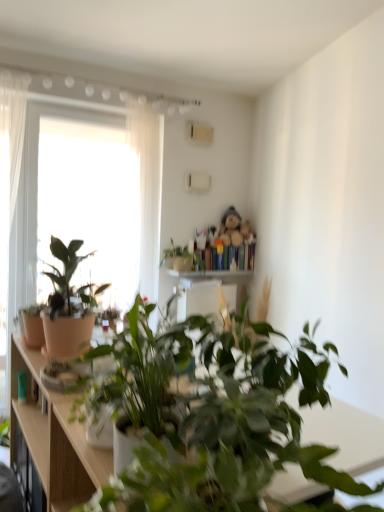
Question: Can you confirm if white sheer curtain at upper left is bigger than wooden at center?

Choices:
 (A) no
 (B) yes

Answer: (B)

Question: Is wooden at center at the back of white sheer curtain at upper left?

Choices:
 (A) no
 (B) yes

Answer: (A)

Question: From the image's perspective, does white sheer curtain at upper left appear lower than wooden at center?

Choices:
 (A) yes
 (B) no

Answer: (B)

Question: Is white sheer curtain at upper left not near wooden at center?

Choices:
 (A) no
 (B) yes

Answer: (A)

Question: Considering the relative sizes of white sheer curtain at upper left and wooden at center in the image provided, is white sheer curtain at upper left smaller than wooden at center?

Choices:
 (A) no
 (B) yes

Answer: (A)

Question: From a real-world perspective, is matte brown cabinet at left physically located above or below matte terracotta pot at left, arranged as the second houseplant when viewed from the back?

Choices:
 (A) above
 (B) below

Answer: (B)

Question: Is matte brown cabinet at left in front of or behind matte terracotta pot at left, arranged as the third houseplant when viewed from the front, in the image?

Choices:
 (A) behind
 (B) front

Answer: (A)

Question: From the image's perspective, is matte brown cabinet at left above or below matte terracotta pot at left, arranged as the second houseplant when viewed from the back?

Choices:
 (A) below
 (B) above

Answer: (A)

Question: Would you say matte brown cabinet at left is to the left or to the right of matte terracotta pot at left, arranged as the third houseplant when viewed from the front, in the picture?

Choices:
 (A) left
 (B) right

Answer: (A)

Question: Is matte terracotta pot at left, arranged as the second houseplant when viewed from the back, in front of or behind matte white pot at center, the first houseplant in the front-to-back sequence, in the image?

Choices:
 (A) behind
 (B) front

Answer: (A)

Question: Based on their sizes in the image, would you say matte terracotta pot at left, arranged as the second houseplant when viewed from the back, is bigger or smaller than matte white pot at center, which is the fourth houseplant in back-to-front order?

Choices:
 (A) small
 (B) big

Answer: (A)

Question: From a real-world perspective, is matte terracotta pot at left, arranged as the second houseplant when viewed from the back, physically located above or below matte white pot at center, which is the fourth houseplant in back-to-front order?

Choices:
 (A) below
 (B) above

Answer: (B)

Question: In terms of height, does matte terracotta pot at left, arranged as the third houseplant when viewed from the front, look taller or shorter compared to matte white pot at center, which is the fourth houseplant in back-to-front order?

Choices:
 (A) short
 (B) tall

Answer: (B)

Question: Is green matte plant at upper center, placed as the first houseplant when sorted from back to front, in front of or behind matte white pot at center, which is the fourth houseplant in back-to-front order, in the image?

Choices:
 (A) behind
 (B) front

Answer: (A)

Question: In terms of size, does green matte plant at upper center, placed as the first houseplant when sorted from back to front, appear bigger or smaller than matte white pot at center, which is the fourth houseplant in back-to-front order?

Choices:
 (A) small
 (B) big

Answer: (A)